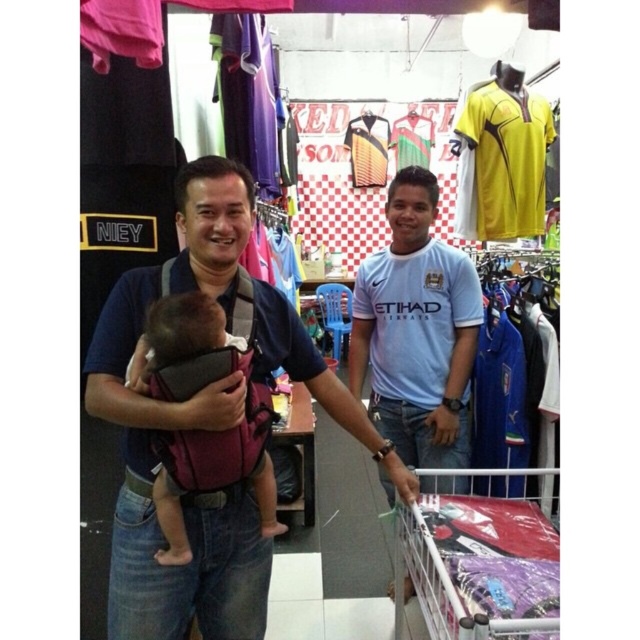
Is metallic silver cart at lower right to the left of dark purple fabric carrier at center from the viewer's perspective?

In fact, metallic silver cart at lower right is to the right of dark purple fabric carrier at center.

You are a GUI agent. You are given a task and a screenshot of the screen. Output one action in this format:
    pyautogui.click(x=<x>, y=<y>)
    Task: Click on the metallic silver cart at lower right
    
    Given the screenshot: What is the action you would take?
    pyautogui.click(x=477, y=566)

The width and height of the screenshot is (640, 640). Find the location of `metallic silver cart at lower right`. metallic silver cart at lower right is located at coordinates (477, 566).

Is point (120, 360) in front of point (410, 436)?

Yes, it is in front of point (410, 436).

Is point (220, 256) more distant than point (413, 392)?

No, it is not.

Does point (131, 452) come in front of point (364, 376)?

That is True.

The height and width of the screenshot is (640, 640). In order to click on maroon fabric baby carrier at center in this screenshot , I will do `click(182, 500)`.

Identify the location of light blue jersey at center. The height and width of the screenshot is (640, 640). (417, 330).

Who is shorter, light blue jersey at center or metallic silver cart at lower right?

With less height is metallic silver cart at lower right.

Who is more forward, (426, 326) or (522, 515)?

Point (522, 515) is more forward.

Image resolution: width=640 pixels, height=640 pixels. I want to click on light blue jersey at center, so click(x=417, y=330).